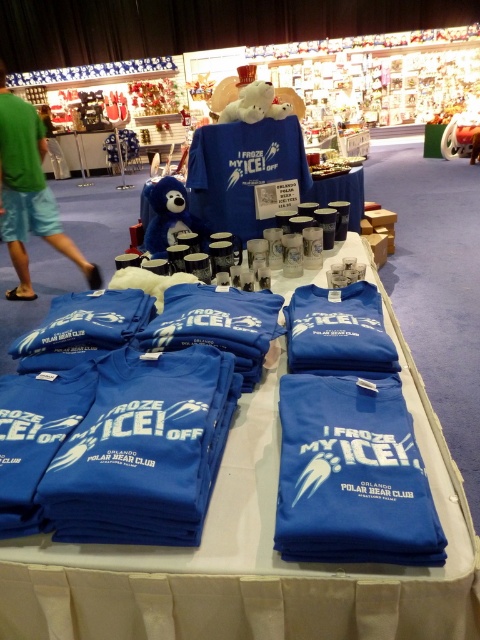
Who is shorter, blue matte t-shirt at center or green cotton t-shirt at left?

blue matte t-shirt at center is shorter.

Between point (402, 483) and point (38, 180), which one is positioned in front?

Point (402, 483)

The width and height of the screenshot is (480, 640). Identify the location of blue matte t-shirt at center. (351, 476).

Between green fabric shorts at lower left and green cotton t-shirt at left, which one has less height?

Standing shorter between the two is green cotton t-shirt at left.

From the picture: Between green fabric shorts at lower left and green cotton t-shirt at left, which one has more height?

Standing taller between the two is green fabric shorts at lower left.

Who is more distant from viewer, (35, 141) or (15, 134)?

The point (35, 141) is behind.

Find the location of a particular element. The image size is (480, 640). green fabric shorts at lower left is located at coordinates (28, 193).

What do you see at coordinates (253, 548) in the screenshot?
I see `blue fabric t-shirts at center` at bounding box center [253, 548].

Which is behind, point (57, 628) or point (46, 150)?

Point (46, 150)

At what (x,y) coordinates should I click in order to perform the action: click on blue fabric t-shirts at center. Please return your answer as a coordinate pair (x, y). Image resolution: width=480 pixels, height=640 pixels. Looking at the image, I should click on (253, 548).